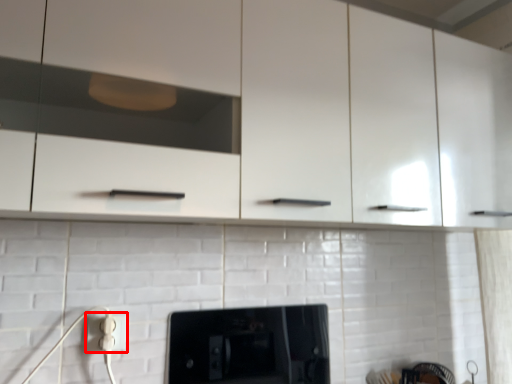
Question: From the image's perspective, where is electric outlet (annotated by the red box) located in relation to home appliance in the image?

Choices:
 (A) below
 (B) above

Answer: (B)